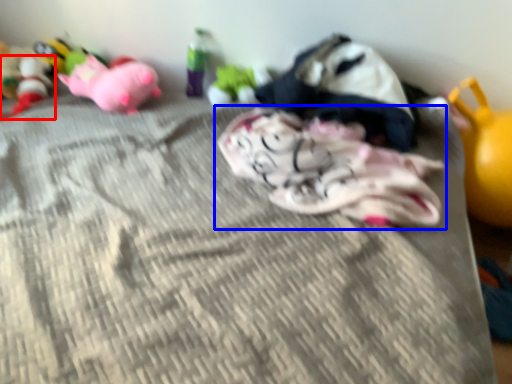
Question: Which point is closer to the camera, toy (highlighted by a red box) or toy (highlighted by a blue box)?

Choices:
 (A) toy
 (B) toy

Answer: (B)